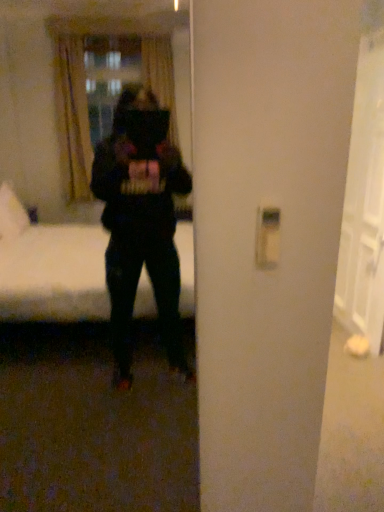
Question: From the image's perspective, is white glossy door at right above black matte mirror at center?

Choices:
 (A) yes
 (B) no

Answer: (A)

Question: From the image's perspective, is white glossy door at right below black matte mirror at center?

Choices:
 (A) yes
 (B) no

Answer: (B)

Question: Is white glossy door at right in contact with black matte mirror at center?

Choices:
 (A) no
 (B) yes

Answer: (A)

Question: Is white glossy door at right at the left side of black matte mirror at center?

Choices:
 (A) no
 (B) yes

Answer: (A)

Question: From a real-world perspective, is white glossy door at right on black matte mirror at center?

Choices:
 (A) no
 (B) yes

Answer: (A)

Question: From their relative heights in the image, would you say white plastic light switch at right is taller or shorter than black matte mirror at center?

Choices:
 (A) tall
 (B) short

Answer: (B)

Question: From the image's perspective, is white plastic light switch at right above or below black matte mirror at center?

Choices:
 (A) above
 (B) below

Answer: (A)

Question: In terms of size, does white plastic light switch at right appear bigger or smaller than black matte mirror at center?

Choices:
 (A) small
 (B) big

Answer: (A)

Question: Would you say white plastic light switch at right is inside or outside black matte mirror at center?

Choices:
 (A) inside
 (B) outside

Answer: (B)

Question: Would you say black matte mirror at center is to the left or to the right of white glossy door at right in the picture?

Choices:
 (A) left
 (B) right

Answer: (A)

Question: Is point (36, 112) positioned closer to the camera than point (370, 54)?

Choices:
 (A) closer
 (B) farther

Answer: (B)

Question: From a real-world perspective, is black matte mirror at center positioned above or below white glossy door at right?

Choices:
 (A) below
 (B) above

Answer: (B)

Question: Looking at their shapes, would you say black matte mirror at center is wider or thinner than white glossy door at right?

Choices:
 (A) wide
 (B) thin

Answer: (B)

Question: Is white plastic light switch at right wider or thinner than white glossy door at right?

Choices:
 (A) wide
 (B) thin

Answer: (B)

Question: Would you say white plastic light switch at right is to the left or to the right of white glossy door at right in the picture?

Choices:
 (A) left
 (B) right

Answer: (A)